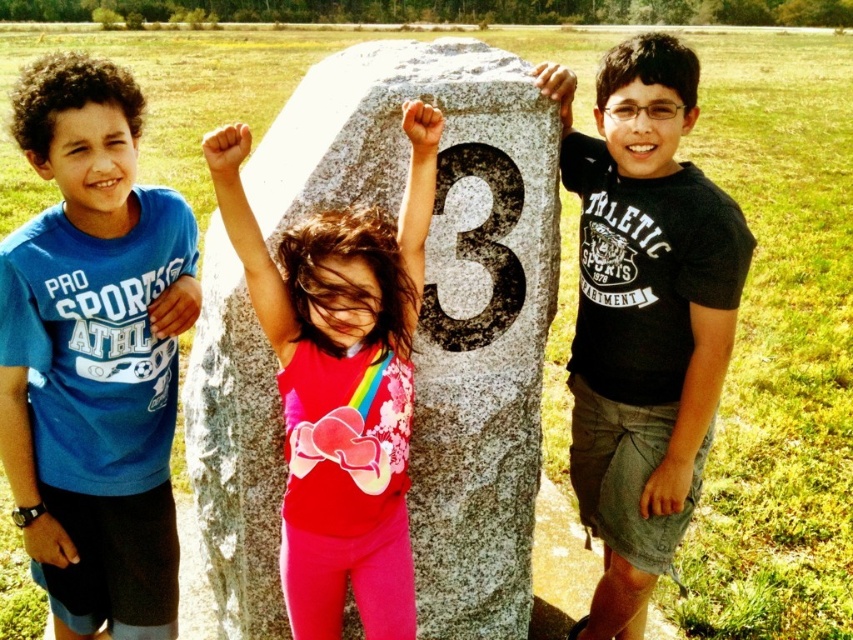
Is point (53, 136) positioned in front of point (480, 172)?

Yes, point (53, 136) is in front of point (480, 172).

Where is `blue t-shirt at left`? This screenshot has width=853, height=640. blue t-shirt at left is located at coordinates (93, 355).

Which is behind, point (86, 340) or point (393, 529)?

The point (393, 529) is more distant.

Does blue t-shirt at left come in front of matte pink leggings at center?

No.

Does point (152, 243) come farther from viewer compared to point (202, 145)?

Yes, point (152, 243) is farther from viewer.

I want to click on blue t-shirt at left, so click(93, 355).

Between black cotton t-shirt at center and matte pink leggings at center, which one appears on the right side from the viewer's perspective?

Positioned to the right is black cotton t-shirt at center.

Is point (607, 221) in front of point (292, 524)?

No, (607, 221) is behind (292, 524).

Is point (642, 356) less distant than point (320, 534)?

No, it is behind (320, 534).

Identify the location of black cotton t-shirt at center. The height and width of the screenshot is (640, 853). (643, 316).